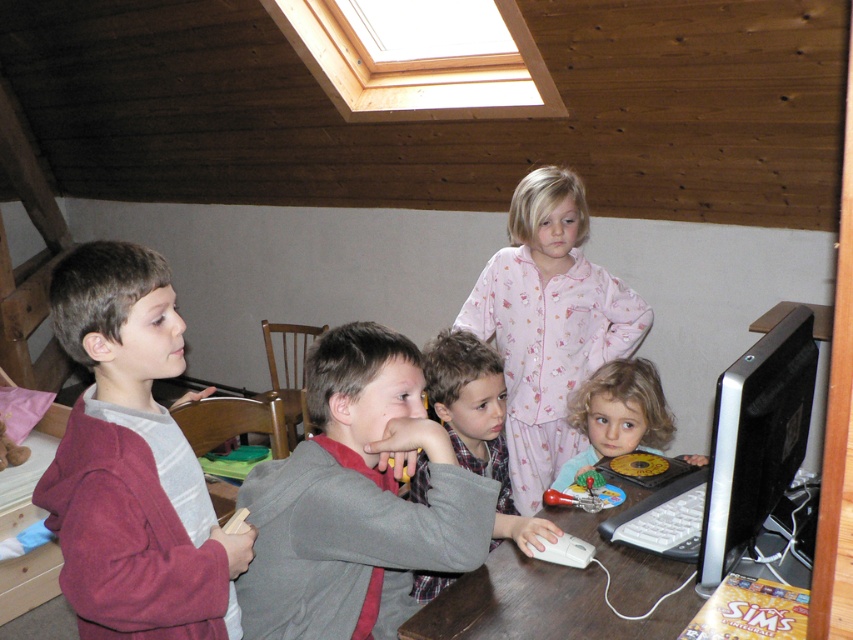
You are a photographer trying to capture a candid shot of the children in the loft. You notice the pink cotton pajamas at center and the blonde curly hair at lower center. Which child should you focus on to ensure both are visible in the frame?

You should focus on the pink cotton pajamas at center because it is above the blonde curly hair at lower center, so capturing the upper part of the frame will include both.

You are a tailor who needs to determine which item is narrower between the maroon fleece jacket at left and the blonde curly hair at lower center. Based on the scene, which one should you choose?

The maroon fleece jacket at left is thinner than the blonde curly hair at lower center, so the maroon fleece jacket at left is narrower.